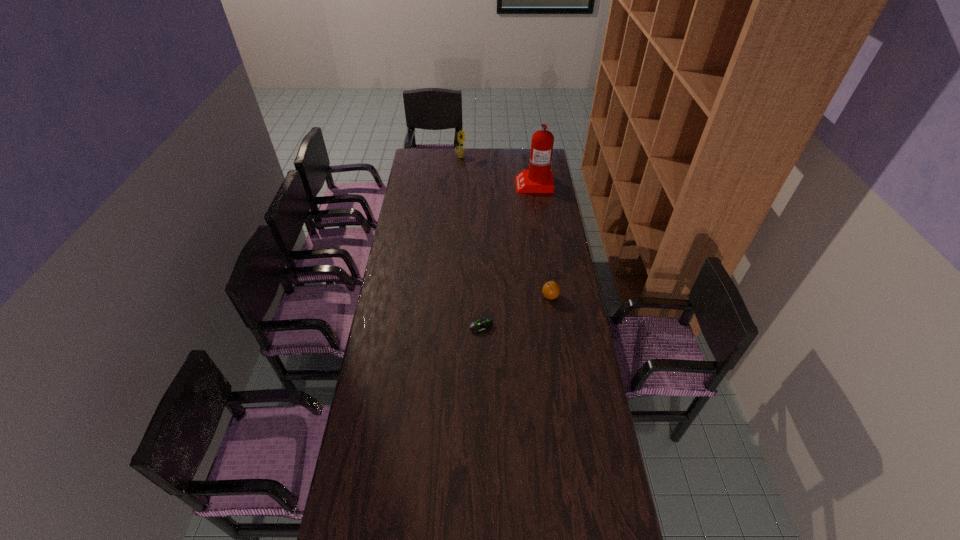
This screenshot has width=960, height=540. I want to click on free area in between the leftmost object and the fire extinguisher, so click(x=497, y=171).

This screenshot has height=540, width=960. I want to click on free space between the second farthest object and the shortest object, so click(508, 255).

What are the coordinates of `vacant space that is in between the sunflower and the orange` in the screenshot? It's located at (505, 227).

Identify the location of free space between the leftmost object and the third farthest object. [505, 227].

This screenshot has height=540, width=960. In order to click on unoccupied area between the second shortest object and the shortest object in this screenshot , I will do `click(516, 312)`.

Locate an element on the screen. Image resolution: width=960 pixels, height=540 pixels. free point between the shortest object and the leftmost object is located at coordinates (471, 242).

This screenshot has width=960, height=540. What are the coordinates of `unoccupied position between the sunflower and the third nearest object` in the screenshot? It's located at (497, 171).

Find the location of a particular element. Image resolution: width=960 pixels, height=540 pixels. free space that is in between the second shortest object and the nearest object is located at coordinates coord(516,312).

Find the location of `empty space that is in between the orange and the tallest object`. empty space that is in between the orange and the tallest object is located at coordinates point(541,240).

The image size is (960, 540). I want to click on free spot between the computer mouse and the sunflower, so click(x=471, y=242).